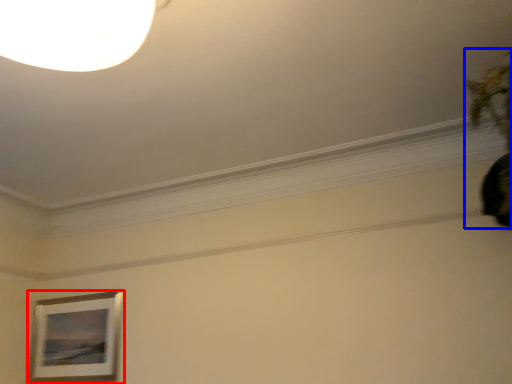
Question: Which object is further to the camera taking this photo, picture frame (highlighted by a red box) or plant (highlighted by a blue box)?

Choices:
 (A) picture frame
 (B) plant

Answer: (A)